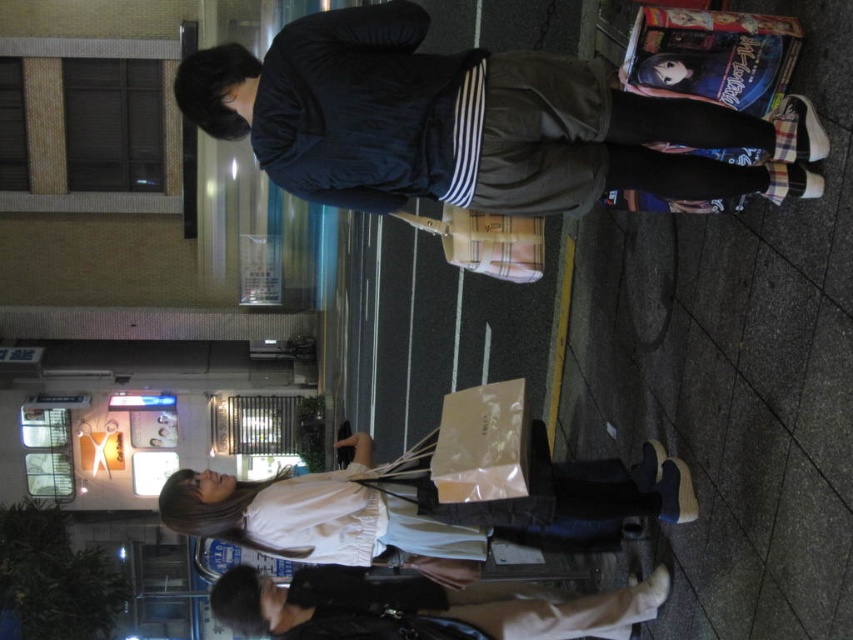
Question: Which point is farther from the camera taking this photo?

Choices:
 (A) (187, 70)
 (B) (230, 604)

Answer: (B)

Question: Is dark blue corduroy pants at center positioned in front of matte beige paper bag at center?

Choices:
 (A) yes
 (B) no

Answer: (A)

Question: Estimate the real-world distances between objects in this image. Which object is farther from the dark blue corduroy pants at center?

Choices:
 (A) white cotton blouse at lower center
 (B) smooth concrete pavement at lower right
 (C) matte beige paper bag at center
 (D) light beige leather boots at lower center

Answer: (D)

Question: Can you confirm if smooth concrete pavement at lower right is bigger than light beige leather boots at lower center?

Choices:
 (A) no
 (B) yes

Answer: (A)

Question: Observing the image, what is the correct spatial positioning of dark blue corduroy pants at center in reference to light beige leather boots at lower center?

Choices:
 (A) left
 (B) right

Answer: (B)

Question: Which point is closer to the camera?

Choices:
 (A) (654, 157)
 (B) (384, 476)
 (C) (306, 570)

Answer: (A)